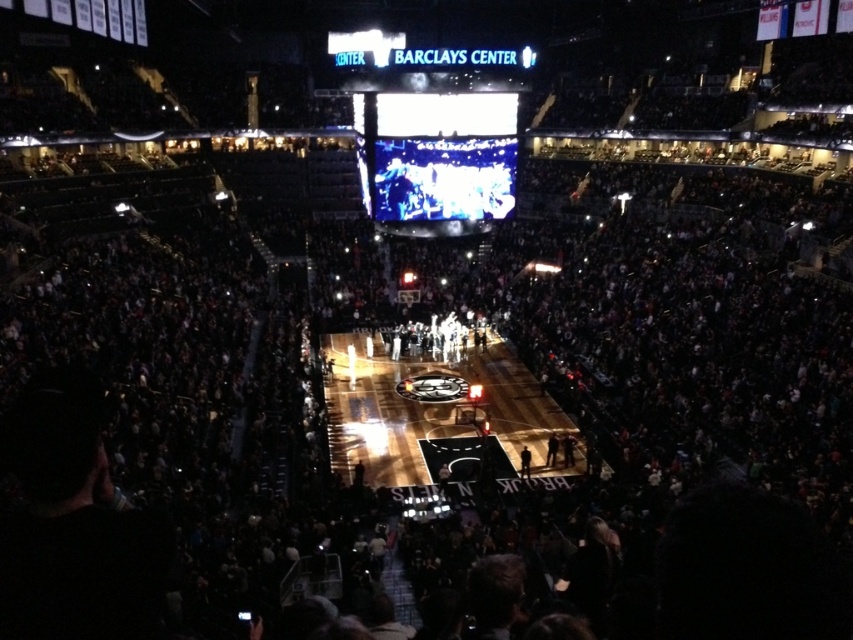
You are a photographer standing at the back of the Barclays Center arena. You want to capture a clear photo of the glossy wooden court at center. Considering the distance, is it feasible to take the photo without zooming in?

The glossy wooden court at center is 56.95 meters away from the camera. Without zooming in, capturing a clear photo from that distance would be difficult due to the significant distance involved.

You are a stagehand at the Barclays Center preparing for a halftime show. You need to move a 3.5 meter long equipment cart from the dark gray fabric jacket at center to the dark brown leather jacket at center. Can the cart fit between them without needing to be repositioned?

The distance between the dark gray fabric jacket at center and the dark brown leather jacket at center is 3.38 meters. Since the equipment cart is 3.5 meters long, it cannot fit between them without needing to be repositioned.

You are a spectator at the Barclays Center and want to take a photo of the scoreboard. You notice two points marked on your map as point coordinates. If you stand at point (480, 385), will you have an unobstructed view of the scoreboard compared to standing at point (556, 456)?

Point (480, 385) is behind point (556, 456), so standing at point (480, 385) would block your view of the scoreboard compared to standing at point (556, 456).